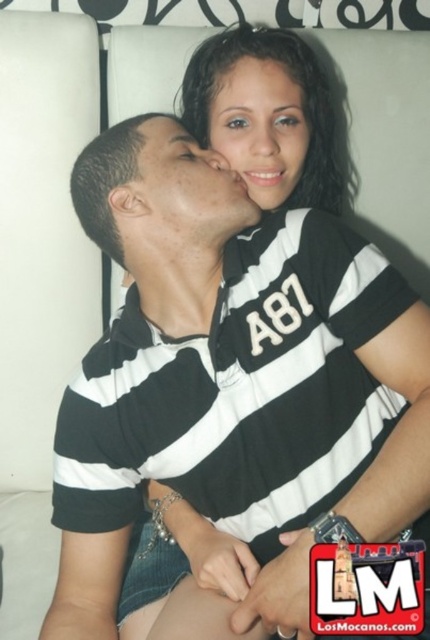
Question: Does black striped polo shirt at center have a lesser width compared to matte black face at upper right?

Choices:
 (A) yes
 (B) no

Answer: (B)

Question: Can you confirm if black striped shirt at upper center is positioned to the right of matte black face at upper center?

Choices:
 (A) no
 (B) yes

Answer: (B)

Question: Estimate the real-world distances between objects in this image. Which object is farther from the black striped polo shirt at center?

Choices:
 (A) matte black face at upper center
 (B) matte black face at upper right

Answer: (A)

Question: Is matte black face at upper center positioned in front of matte black face at upper right?

Choices:
 (A) no
 (B) yes

Answer: (A)

Question: Based on their relative distances, which object is farther from the matte black face at upper right?

Choices:
 (A) black striped polo shirt at center
 (B) matte black face at upper center

Answer: (A)

Question: Among these points, which one is nearest to the camera?

Choices:
 (A) (267, 131)
 (B) (197, 218)
 (C) (267, 132)

Answer: (B)